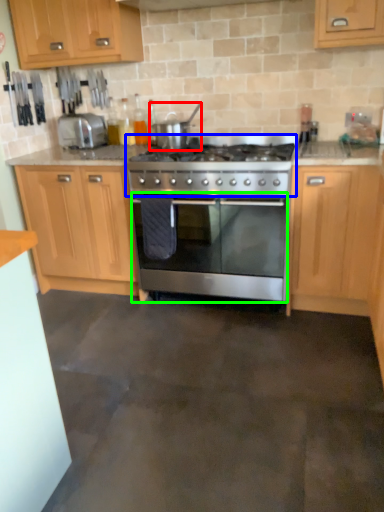
Question: Which object is positioned closest to appliance (highlighted by a red box)? Select from gas stove (highlighted by a blue box) and oven (highlighted by a green box).

Choices:
 (A) gas stove
 (B) oven

Answer: (A)